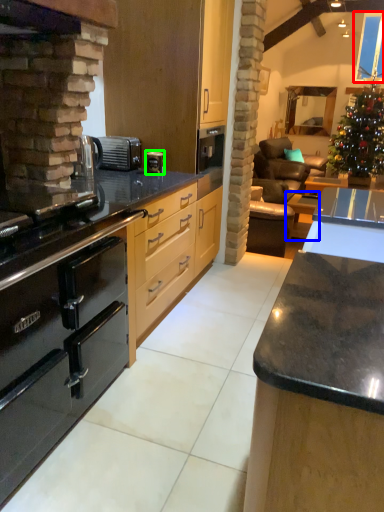
Question: Which object is positioned farthest from window screen (highlighted by a red box)? Select from table (highlighted by a blue box) and coffee machine (highlighted by a green box).

Choices:
 (A) table
 (B) coffee machine

Answer: (B)